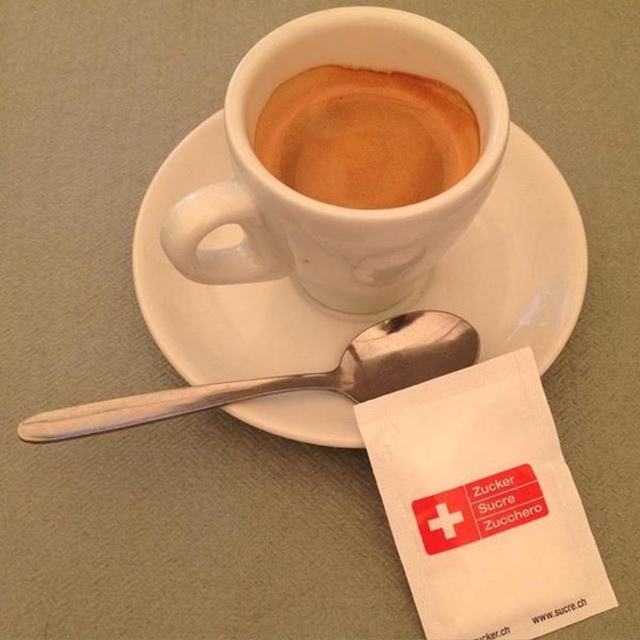
Describe the element at coordinates (374, 314) in the screenshot. The width and height of the screenshot is (640, 640). I see `white ceramic saucer at upper center` at that location.

Does white ceramic saucer at upper center lie behind silver metallic spoon at center?

Yes.

Who is more distant from viewer, (240,365) or (420,353)?

The point (240,365) is behind.

Identify the location of white ceramic saucer at upper center. The width and height of the screenshot is (640, 640). (374, 314).

Who is lower down, white ceramic saucer at upper center or brown matte cup at center?

white ceramic saucer at upper center is lower down.

Between white ceramic saucer at upper center and brown matte cup at center, which one has less height?

Standing shorter between the two is brown matte cup at center.

Between point (456, 241) and point (387, 141), which one is positioned in front?

Positioned in front is point (456, 241).

Where is `white ceramic saucer at upper center`? white ceramic saucer at upper center is located at coordinates (374, 314).

Is brown matte cup at center to the left of silver metallic spoon at center from the viewer's perspective?

In fact, brown matte cup at center is to the right of silver metallic spoon at center.

Which of these two, brown matte cup at center or silver metallic spoon at center, stands taller?

Standing taller between the two is brown matte cup at center.

Which is behind, point (428, 176) or point (212, 406)?

Point (212, 406)

Identify the location of brown matte cup at center. This screenshot has height=640, width=640. (365, 136).